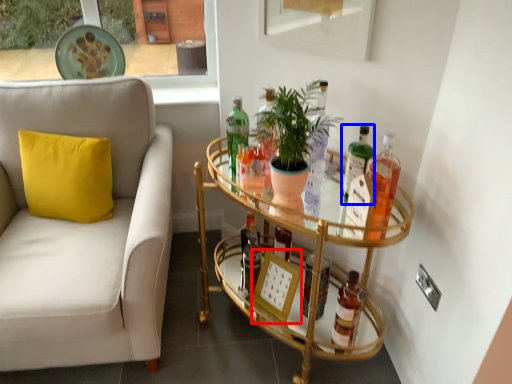
Question: Which point is closer to the camera, picture frame (highlighted by a red box) or bottle (highlighted by a blue box)?

Choices:
 (A) picture frame
 (B) bottle

Answer: (B)